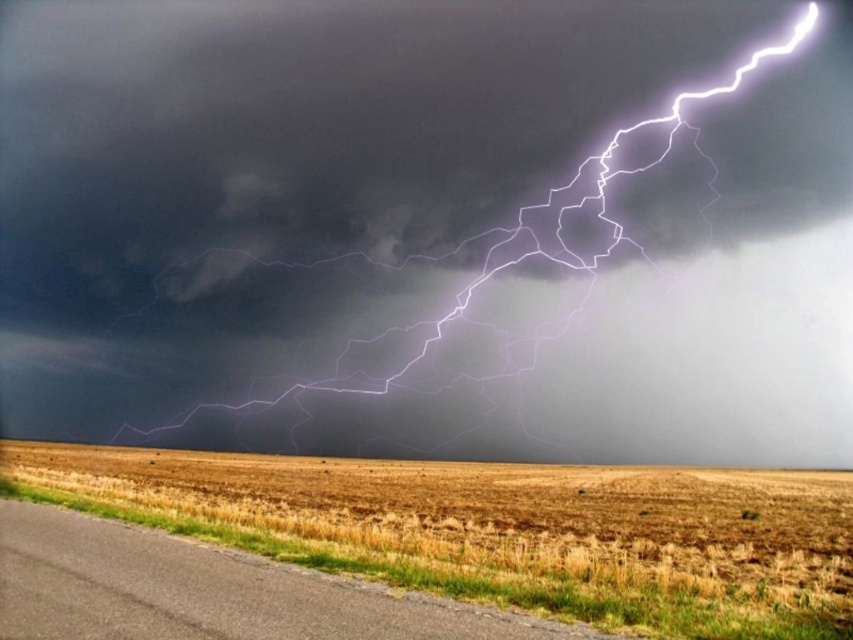
You are a photographer trying to capture the lightning strike and the dry grass in your shot. If you want to ensure both the white lightning at upper right and the dry grass at lower left are visible in the frame, which object should you adjust your focus on to account for their size difference?

You should focus on the white lightning at upper right because its width is larger than the dry grass at lower left, making it the more prominent feature in the frame.